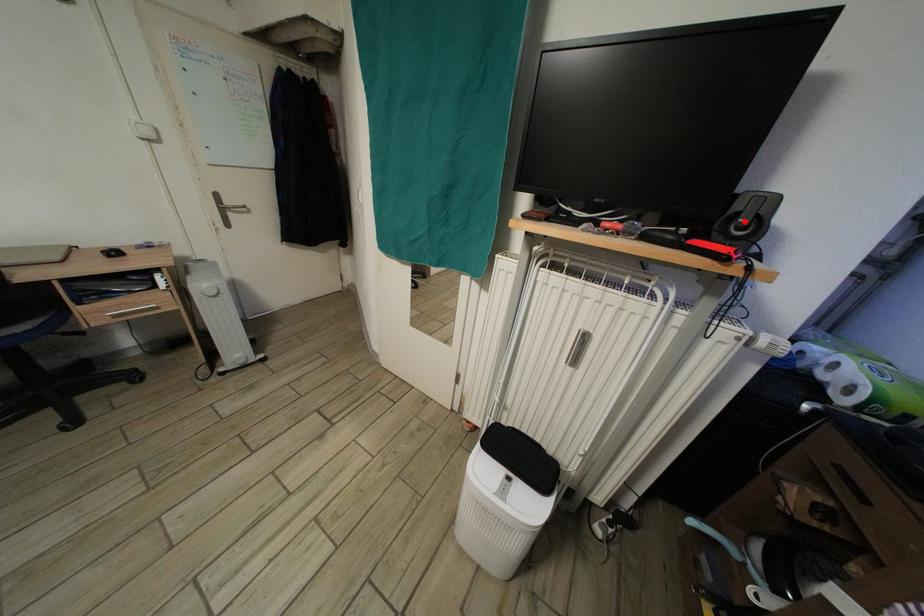
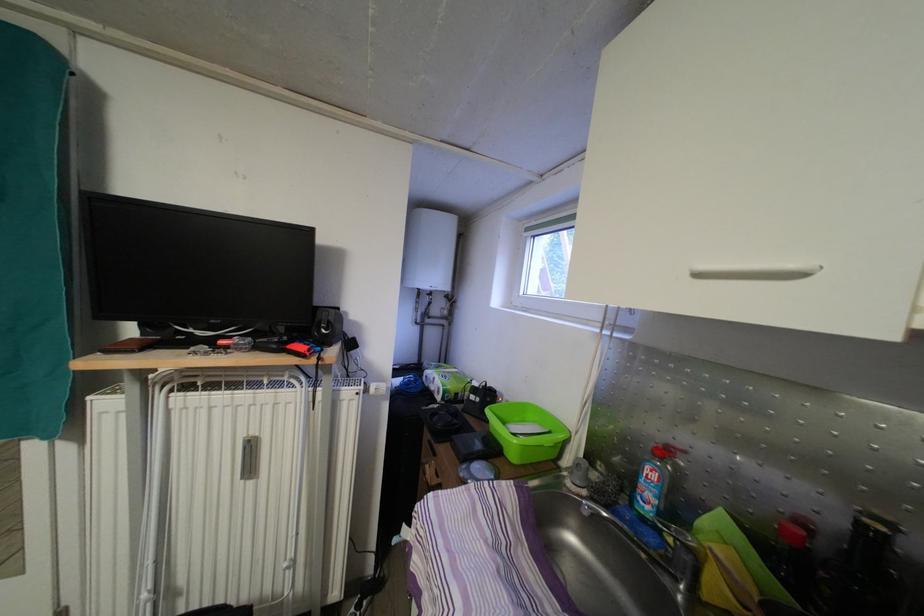
Locate, in the second image, the point that corresponds to the highlighted location in the first image.

(326, 329)